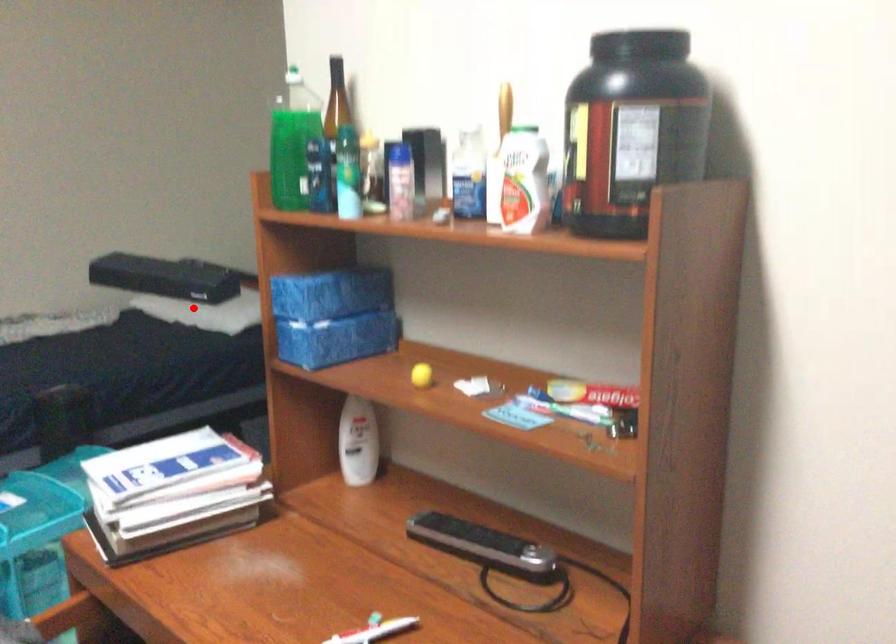
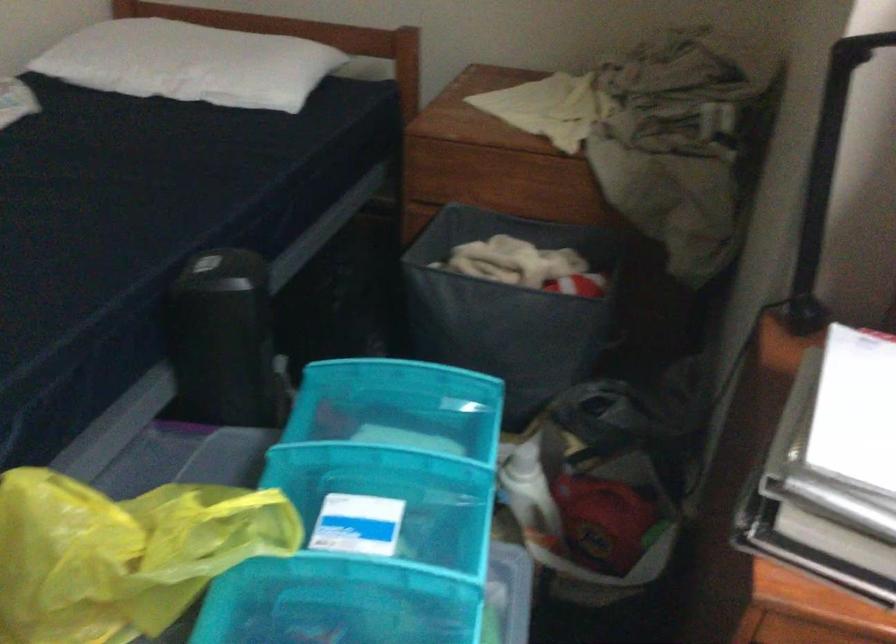
Question: I am providing you with two images of the same scene from different viewpoints. A red point is shown in image1. For the corresponding object point in image2, is it positioned nearer or farther from the camera?

Choices:
 (A) Nearer
 (B) Farther

Answer: (A)